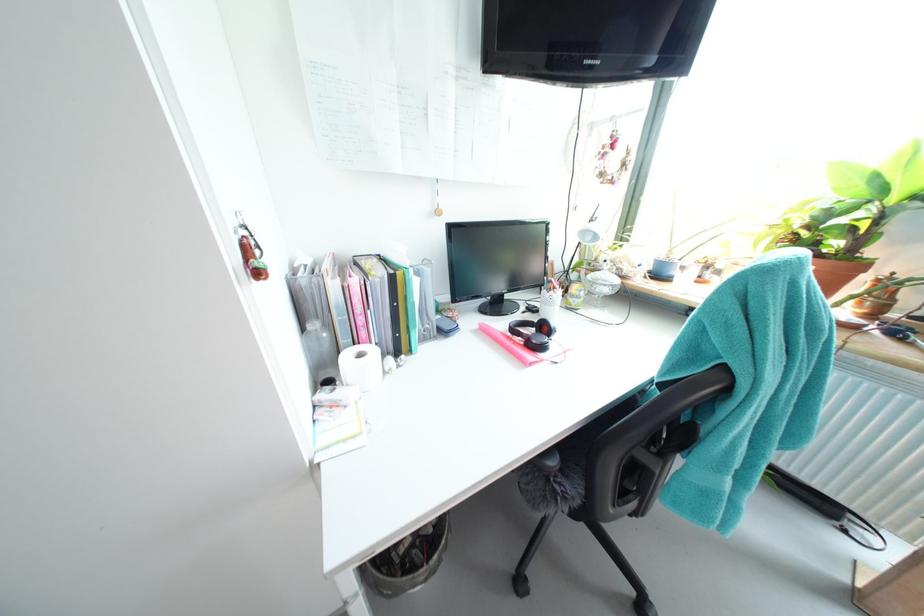
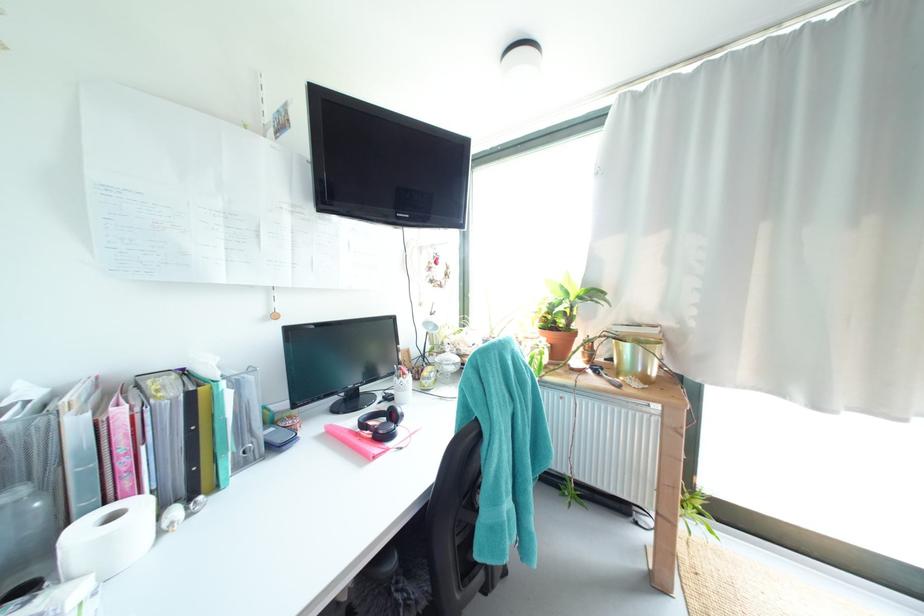
In the second image, find the point that corresponds to (542,342) in the first image.

(388, 434)